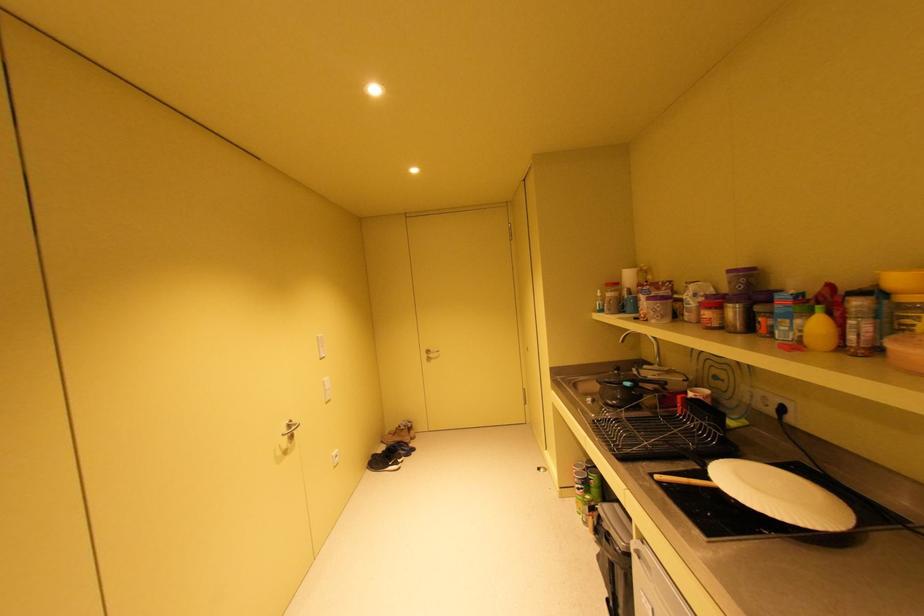
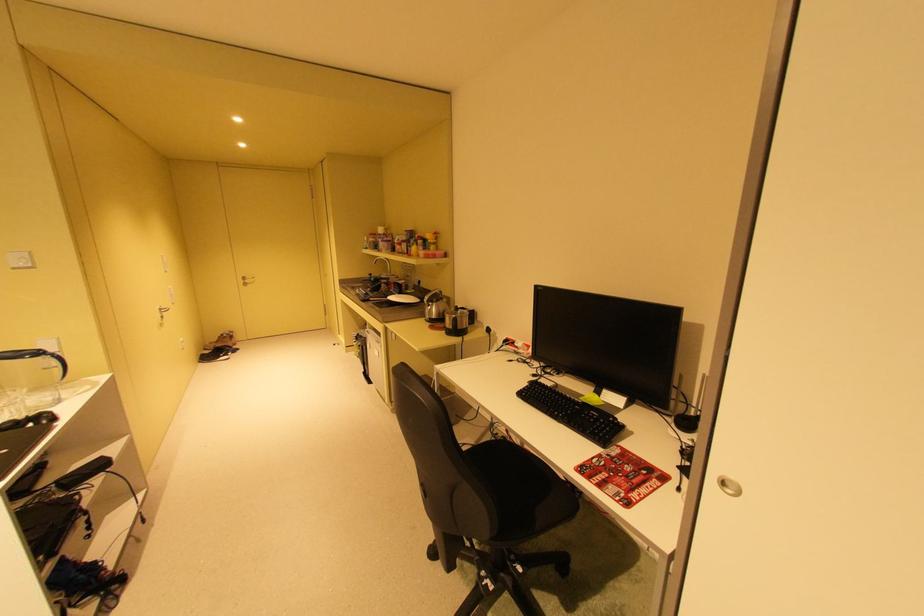
In the second image, find the point that corresponds to (x=636, y=338) in the first image.

(385, 262)